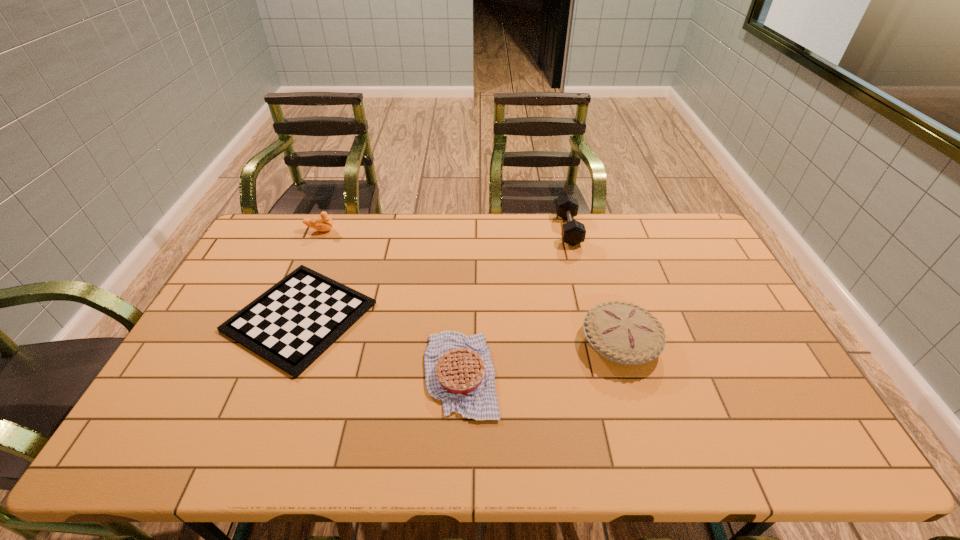
Choose which object is the nearest neighbor to the shorter pie. Please provide its 2D coordinates. Your answer should be formatted as a tuple, i.e. [(x, y)], where the tuple contains the x and y coordinates of a point satisfying the conditions above.

[(290, 325)]

Where is `free location that satisfies the following two spatial constraints: 1. on the face of the duckling; 2. on the right side of the taller pie`? This screenshot has width=960, height=540. free location that satisfies the following two spatial constraints: 1. on the face of the duckling; 2. on the right side of the taller pie is located at coordinates (273, 342).

Image resolution: width=960 pixels, height=540 pixels. Identify the location of vacant position in the image that satisfies the following two spatial constraints: 1. on the face of the taller pie; 2. on the right side of the duckling. (273, 342).

Identify the location of blank space that satisfies the following two spatial constraints: 1. on the front side of the dumbbell; 2. on the right side of the taller pie. The height and width of the screenshot is (540, 960). (596, 342).